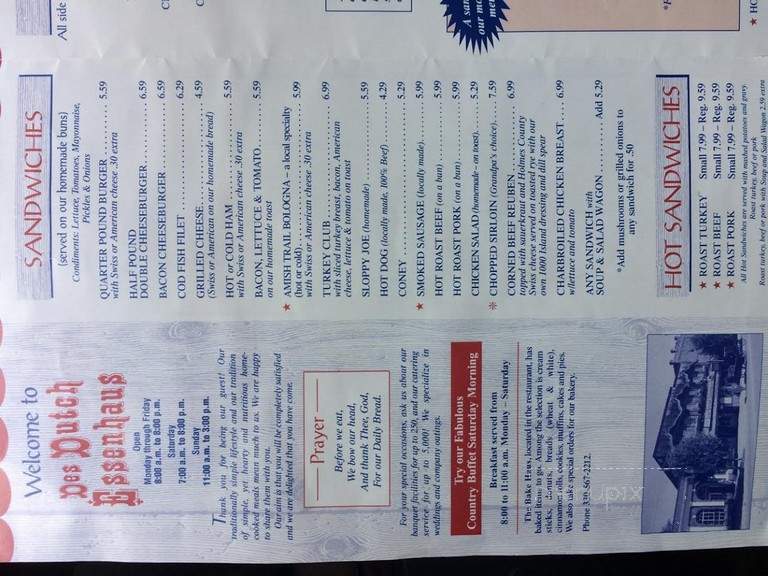
You are a GUI agent. You are given a task and a screenshot of the screen. Output one action in this format:
    pyautogui.click(x=<x>, y=<y>)
    Task: Click on the photo of restaurant
    
    Given the screenshot: What is the action you would take?
    pyautogui.click(x=702, y=446)